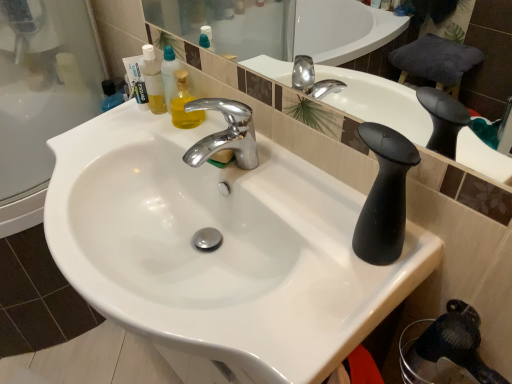
Describe the element at coordinates (153, 80) in the screenshot. I see `translucent plastic mouthwash at upper left` at that location.

What do you see at coordinates (136, 80) in the screenshot? I see `white matte toothpaste tube at upper left` at bounding box center [136, 80].

Image resolution: width=512 pixels, height=384 pixels. I want to click on translucent plastic mouthwash at upper left, so click(153, 80).

Is white glossy sink at center inside the boundaries of translucent plastic mouthwash at upper left, or outside?

The correct answer is: outside.

Considering the positions of points (145, 324) and (147, 44), is point (145, 324) closer to camera compared to point (147, 44)?

Yes, it is in front of point (147, 44).

From the image's perspective, between white glossy sink at center and translucent plastic mouthwash at upper left, which one is located above?

translucent plastic mouthwash at upper left.

From a real-world perspective, is white glossy sink at center under translucent plastic mouthwash at upper left?

Yes.

Considering the positions of point (180, 198) and point (140, 70), is point (180, 198) closer or farther from the camera than point (140, 70)?

Point (180, 198) is positioned closer to the camera compared to point (140, 70).

Is white glossy sink at center beside white matte toothpaste tube at upper left?

No, white glossy sink at center is not in contact with white matte toothpaste tube at upper left.

In terms of size, does white glossy sink at center appear bigger or smaller than white matte toothpaste tube at upper left?

white glossy sink at center is bigger than white matte toothpaste tube at upper left.

From the image's perspective, between translucent plastic mouthwash at upper left and white glossy sink at center, who is located below?

white glossy sink at center.

From a real-world perspective, is translucent plastic mouthwash at upper left located beneath white glossy sink at center?

No.

Which object is thinner, translucent plastic mouthwash at upper left or white glossy sink at center?

translucent plastic mouthwash at upper left.

Would you consider translucent plastic mouthwash at upper left to be distant from white glossy sink at center?

That's not correct — translucent plastic mouthwash at upper left is a little close to white glossy sink at center.

Would you say white matte toothpaste tube at upper left is a long distance from white glossy sink at center?

No.

Can you confirm if white matte toothpaste tube at upper left is thinner than white glossy sink at center?

Yes.

In the scene shown: From the image's perspective, which one is positioned higher, white matte toothpaste tube at upper left or white glossy sink at center?

white matte toothpaste tube at upper left, from the image's perspective.

Considering the sizes of objects white matte toothpaste tube at upper left and white glossy sink at center in the image provided, who is shorter, white matte toothpaste tube at upper left or white glossy sink at center?

white matte toothpaste tube at upper left.

Which is closer, (154, 54) or (139, 56)?

Positioned in front is point (154, 54).

How distant is translucent plastic mouthwash at upper left from white matte toothpaste tube at upper left?

1.47 inches.

Is translucent plastic mouthwash at upper left at the left side of white matte toothpaste tube at upper left?

No, translucent plastic mouthwash at upper left is not to the left of white matte toothpaste tube at upper left.

Between translucent plastic mouthwash at upper left and white matte toothpaste tube at upper left, which one has smaller width?

Thinner between the two is translucent plastic mouthwash at upper left.

Which object is closer to the camera, white matte toothpaste tube at upper left or translucent plastic mouthwash at upper left?

Positioned in front is translucent plastic mouthwash at upper left.

Which is correct: white matte toothpaste tube at upper left is inside translucent plastic mouthwash at upper left, or outside of it?

white matte toothpaste tube at upper left is spatially situated outside translucent plastic mouthwash at upper left.

Between white matte toothpaste tube at upper left and translucent plastic mouthwash at upper left, which one has larger size?

Bigger between the two is translucent plastic mouthwash at upper left.

Locate an element on the screen. The image size is (512, 384). mouthwash that is on the left side of white glossy sink at center is located at coordinates (153, 80).

You are a GUI agent. You are given a task and a screenshot of the screen. Output one action in this format:
    pyautogui.click(x=<x>, y=<y>)
    Task: Click on the toiletry behind the white glossy sink at center
    
    Given the screenshot: What is the action you would take?
    pyautogui.click(x=136, y=80)

Estimate the real-world distances between objects in this image. Which object is closer to white matte toothpaste tube at upper left, translucent plastic mouthwash at upper left or white glossy sink at center?

Among the two, translucent plastic mouthwash at upper left is located nearer to white matte toothpaste tube at upper left.

Which object lies nearer to the anchor point translucent plastic mouthwash at upper left, white matte toothpaste tube at upper left or white glossy sink at center?

Based on the image, white matte toothpaste tube at upper left appears to be nearer to translucent plastic mouthwash at upper left.

From the image, which object appears to be farther from white matte toothpaste tube at upper left, white glossy sink at center or translucent plastic mouthwash at upper left?

The object further to white matte toothpaste tube at upper left is white glossy sink at center.

Considering their positions, is white matte toothpaste tube at upper left positioned closer to white glossy sink at center than translucent plastic mouthwash at upper left?

translucent plastic mouthwash at upper left lies closer to white glossy sink at center than the other object.

Based on their spatial positions, is translucent plastic mouthwash at upper left or white matte toothpaste tube at upper left closer to white glossy sink at center?

Based on the image, translucent plastic mouthwash at upper left appears to be nearer to white glossy sink at center.

Looking at this image, estimate the real-world distances between objects in this image. Which object is further from translucent plastic mouthwash at upper left, white glossy sink at center or white matte toothpaste tube at upper left?

Based on the image, white glossy sink at center appears to be further to translucent plastic mouthwash at upper left.

Where is `mouthwash between white glossy sink at center and white matte toothpaste tube at upper left along the z-axis`? The width and height of the screenshot is (512, 384). mouthwash between white glossy sink at center and white matte toothpaste tube at upper left along the z-axis is located at coordinates pyautogui.click(x=153, y=80).